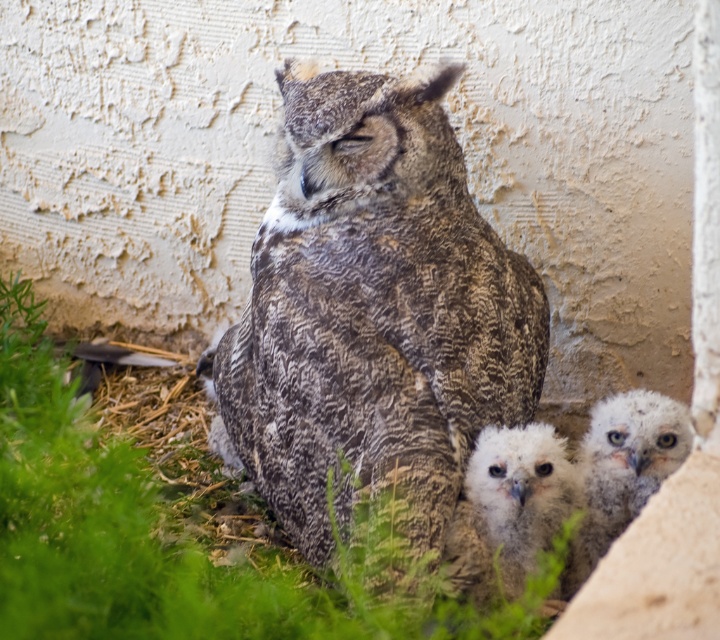
Question: Can you confirm if speckled feathered owl at center is thinner than fluffy white owl at lower center?

Choices:
 (A) yes
 (B) no

Answer: (B)

Question: Does speckled feathered owl at center appear under white fluffy owl at lower right?

Choices:
 (A) yes
 (B) no

Answer: (B)

Question: Does fluffy white owl at lower center appear over white fluffy owl at lower right?

Choices:
 (A) no
 (B) yes

Answer: (A)

Question: Considering the real-world distances, which object is farthest from the white fluffy owl at lower right?

Choices:
 (A) fluffy white owl at lower center
 (B) speckled feathered owl at center

Answer: (B)

Question: Which point is closer to the camera?

Choices:
 (A) speckled feathered owl at center
 (B) fluffy white owl at lower center

Answer: (A)

Question: Which object is closer to the camera taking this photo?

Choices:
 (A) white fluffy owl at lower right
 (B) fluffy white owl at lower center

Answer: (B)